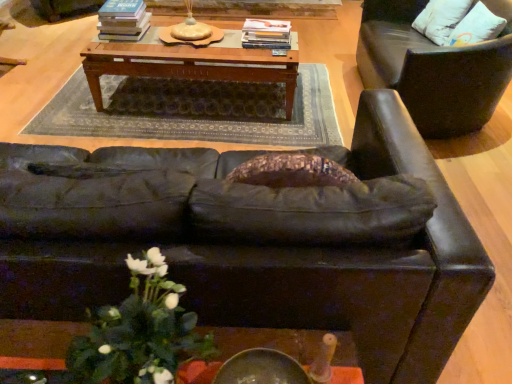
Identify the location of vacant location below wooden table at center (from a real-world perspective). (212, 102).